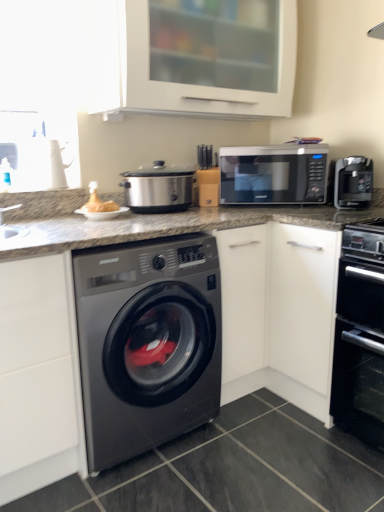
Identify the location of satin silver slow cooker at center. Image resolution: width=384 pixels, height=512 pixels. (158, 188).

The height and width of the screenshot is (512, 384). Describe the element at coordinates (353, 182) in the screenshot. I see `sleek black coffee maker at right` at that location.

In order to face white matte cabinet at upper center, should I rotate leftwards or rightwards?

You should rotate right by 1.195 degrees.

This screenshot has height=512, width=384. In order to click on satin silver slow cooker at center in this screenshot , I will do `click(158, 188)`.

Measure the distance from satin black washing machine at center to black matte microwave at upper right.

satin black washing machine at center is 31.06 inches from black matte microwave at upper right.

Between satin black washing machine at center and black matte microwave at upper right, which one has more height?

Standing taller between the two is satin black washing machine at center.

Relative to black matte microwave at upper right, is satin black washing machine at center in front or behind?

Visually, satin black washing machine at center is located in front of black matte microwave at upper right.

Are satin black washing machine at center and black matte microwave at upper right far apart?

That's not correct — satin black washing machine at center is a little close to black matte microwave at upper right.

Is sleek black coffee maker at right to the left or to the right of matte brown bread at upper left in the image?

Clearly, sleek black coffee maker at right is on the right of matte brown bread at upper left in the image.

Does sleek black coffee maker at right have a smaller size compared to matte brown bread at upper left?

No.

Identify the location of coffee machine behind the matte brown bread at upper left. (353, 182).

From the image's perspective, is matte brown bread at upper left below black matte oven at lower right?

No, from the image's perspective, matte brown bread at upper left is not beneath black matte oven at lower right.

Which of these two, matte brown bread at upper left or black matte oven at lower right, stands shorter?

With less height is matte brown bread at upper left.

Is matte brown bread at upper left positioned with its back to black matte oven at lower right?

No, black matte oven at lower right is not at the back of matte brown bread at upper left.

Is point (96, 193) closer to viewer compared to point (342, 335)?

No.

From the image's perspective, is sleek black coffee maker at right on satin silver slow cooker at center?

Yes, from the image's perspective, sleek black coffee maker at right is over satin silver slow cooker at center.

From a real-world perspective, between sleek black coffee maker at right and satin silver slow cooker at center, who is vertically lower?

In real-world perspective, satin silver slow cooker at center is lower.

Can you confirm if sleek black coffee maker at right is thinner than satin silver slow cooker at center?

Indeed, sleek black coffee maker at right has a lesser width compared to satin silver slow cooker at center.

Based on the photo, is sleek black coffee maker at right oriented towards satin silver slow cooker at center?

No, sleek black coffee maker at right is not turned towards satin silver slow cooker at center.

Based on the photo, which is further, (x=186, y=201) or (x=229, y=177)?

The point (x=229, y=177) is more distant.

Which of these two, satin silver slow cooker at center or black matte microwave at upper right, is wider?

black matte microwave at upper right is wider.

Which object is further away from the camera taking this photo, white matte cabinet at upper center or sleek black coffee maker at right?

sleek black coffee maker at right is more distant.

Which object is positioned more to the right, white matte cabinet at upper center or sleek black coffee maker at right?

sleek black coffee maker at right.

Which is less distant, (167, 106) or (362, 174)?

The point (167, 106) is closer to the camera.

Locate an element on the screen. Image resolution: width=384 pixels, height=512 pixels. cabinetry in front of the sleek black coffee maker at right is located at coordinates click(193, 57).

Does white matte cabinet at upper center have a greater height compared to satin silver slow cooker at center?

Indeed, white matte cabinet at upper center has a greater height compared to satin silver slow cooker at center.

From the picture: Can you confirm if white matte cabinet at upper center is bigger than satin silver slow cooker at center?

Yes, white matte cabinet at upper center is bigger than satin silver slow cooker at center.

How much distance is there between white matte cabinet at upper center and satin silver slow cooker at center?

white matte cabinet at upper center is 19.58 inches away from satin silver slow cooker at center.

What are the coordinates of `microwave oven above the satin black washing machine at center (from a real-world perspective)` in the screenshot? It's located at (273, 174).

Where is `coffee machine that is on the right side of matte brown bread at upper left`? coffee machine that is on the right side of matte brown bread at upper left is located at coordinates (353, 182).

Based on the photo, considering their positions, is black matte microwave at upper right positioned further to satin silver slow cooker at center than black matte oven at lower right?

The object further to satin silver slow cooker at center is black matte oven at lower right.

From the picture: Based on their spatial positions, is matte brown bread at upper left or satin silver slow cooker at center further from satin black washing machine at center?

Based on the image, matte brown bread at upper left appears to be further to satin black washing machine at center.

Looking at this image, considering their positions, is satin black washing machine at center positioned further to black matte oven at lower right than satin silver slow cooker at center?

satin silver slow cooker at center lies further to black matte oven at lower right than the other object.

Looking at the image, which one is located further to satin silver slow cooker at center, satin black washing machine at center or matte brown bread at upper left?

satin black washing machine at center lies further to satin silver slow cooker at center than the other object.

Which object lies nearer to the anchor point matte brown bread at upper left, black matte oven at lower right or satin black washing machine at center?

satin black washing machine at center is positioned closer to the anchor matte brown bread at upper left.

Estimate the real-world distances between objects in this image. Which object is closer to satin black washing machine at center, black matte oven at lower right or sleek black coffee maker at right?

black matte oven at lower right.

Looking at the image, which one is located closer to black matte oven at lower right, white matte cabinet at upper center or satin black washing machine at center?

satin black washing machine at center is positioned closer to the anchor black matte oven at lower right.

Based on their spatial positions, is sleek black coffee maker at right or matte brown bread at upper left closer to satin black washing machine at center?

The object closer to satin black washing machine at center is matte brown bread at upper left.

This screenshot has height=512, width=384. In order to click on appliance situated between matte brown bread at upper left and black matte oven at lower right from left to right in this screenshot , I will do `click(158, 188)`.

I want to click on washing machine between matte brown bread at upper left and sleek black coffee maker at right in the horizontal direction, so click(x=147, y=343).

I want to click on appliance between white matte cabinet at upper center and matte brown bread at upper left in the vertical direction, so click(x=158, y=188).

This screenshot has width=384, height=512. I want to click on appliance located between matte brown bread at upper left and sleek black coffee maker at right in the left-right direction, so click(158, 188).